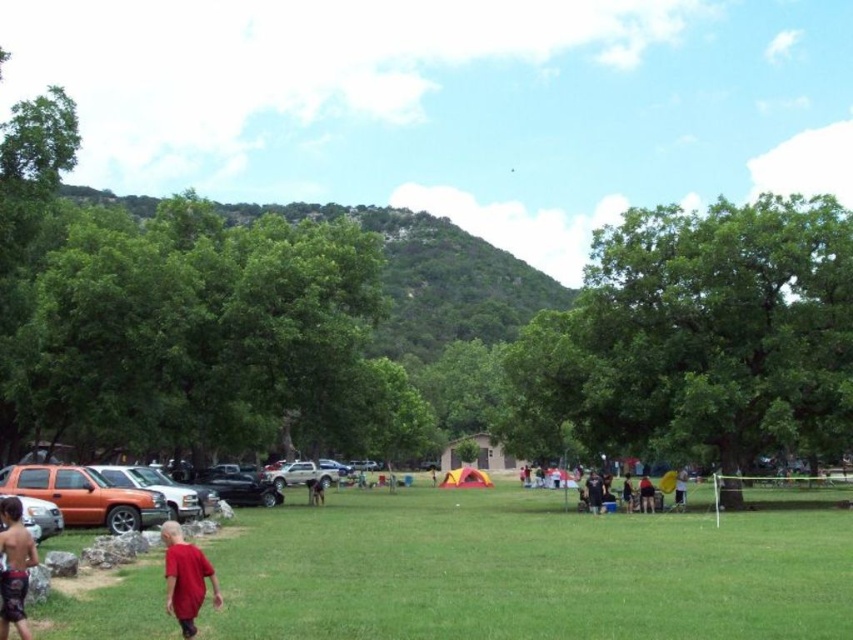
You are standing at the edge of the green grassy field at center and want to see the shiny orange shorts at lower left. Can you see them clearly from your current position?

The shiny orange shorts at lower left is behind the green grassy field at center, so you cannot see them clearly from your current position.

You are standing at the edge of the green grassy field at center and want to find the shiny orange shorts at lower left. Which direction should you look to see them?

The shiny orange shorts at lower left are positioned above the green grassy field at center, so you should look upward from the green grassy field at center to find them.